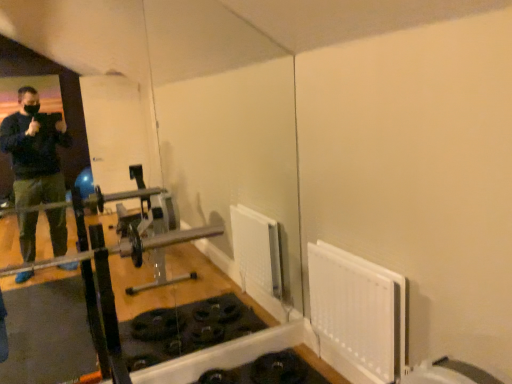
The image size is (512, 384). What do you see at coordinates (357, 314) in the screenshot? I see `white plastic radiator at lower right` at bounding box center [357, 314].

The height and width of the screenshot is (384, 512). I want to click on white plastic radiator at lower right, so pyautogui.click(x=357, y=314).

Identify the location of white plastic radiator at lower right. The width and height of the screenshot is (512, 384). (357, 314).